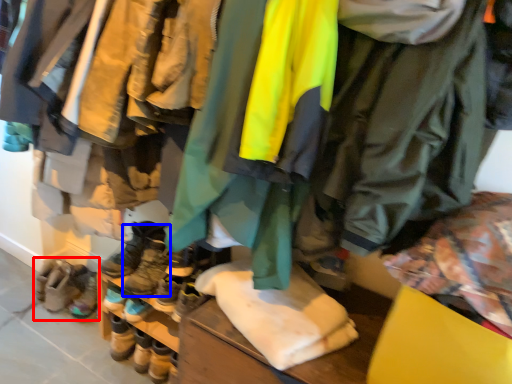
Question: Which object appears farthest to the camera in this image, footwear (highlighted by a red box) or footwear (highlighted by a blue box)?

Choices:
 (A) footwear
 (B) footwear

Answer: (A)